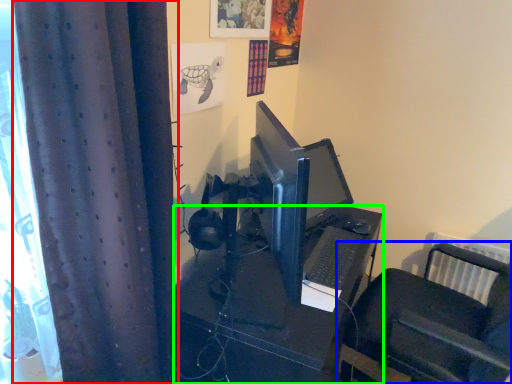
Question: Based on their relative distances, which object is nearer to curtain (highlighted by a red box)? Choose from furniture (highlighted by a blue box) and desk (highlighted by a green box).

Choices:
 (A) furniture
 (B) desk

Answer: (B)